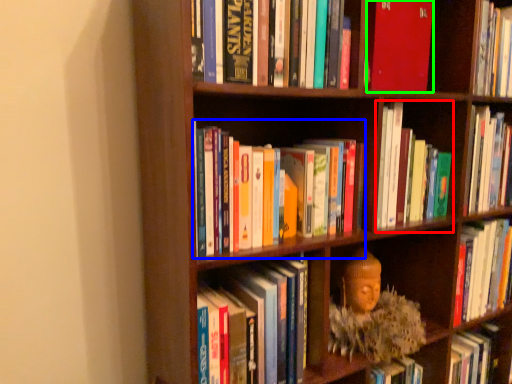
Question: Which object is the farthest from book (highlighted by a red box)? Choose among these: book (highlighted by a blue box) or book (highlighted by a green box).

Choices:
 (A) book
 (B) book

Answer: (A)